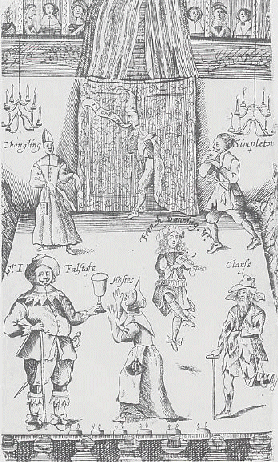
The height and width of the screenshot is (462, 278). I want to click on goblet, so click(101, 287).